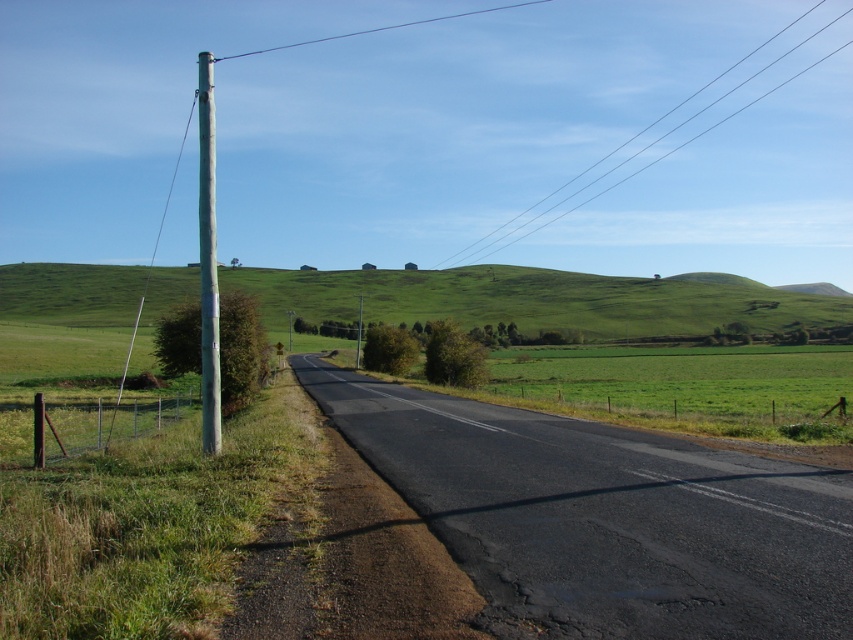
You are a drone operator trying to capture a photo of the green grassy hillside at upper center. The camera is currently positioned at point A. The camera can only move in straight lines. The camera can only move in straight lines. The camera can only move in straight lines. The camera can only move in straight lines. The camera can only move in straight lines. The camera can only move in straight lines. The camera can only move in straight lines. The camera can only move in straight lines. The camera can o

The camera must be positioned at a point that allows a direct line of sight to the green grassy hillside at upper center located at coordinates (532,300). Since the camera can only move in straight lines, it should be aligned along the same axis as the hillside to capture it without obstruction.

You are a drone operator planning to fly a drone between the green grassy hillside at upper center and the metallic gray pole at left. The drone has a maximum flight distance of 60 meters. Can the drone safely make the trip between these two points without exceeding its range?

The green grassy hillside at upper center and metallic gray pole at left are 58.59 meters apart from each other. Since the drone has a maximum flight distance of 60 meters, it can safely make the trip between these two points without exceeding its range.

Based on the photo, you are a drone operator planning to fly a drone over the rural road scene. The drone has a safety restriction that it must not fly within 0.1 units of any point marked in the image. Is the point at coordinates point at point (660, 136) safe for the drone to hover at?

The clear wire at upper center is located at point (660, 136). Since the drone must not fly within 0.1 units of any marked point, hovering at this exact point would violate the safety restriction. Therefore, the point at point (660, 136) is not safe for the drone to hover at.